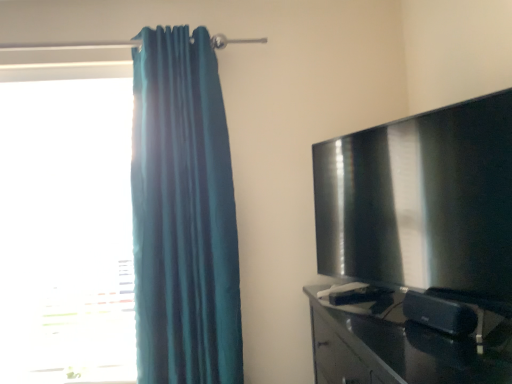
Question: Is matte black tv at right to the right of transparent glass window at left from the viewer's perspective?

Choices:
 (A) no
 (B) yes

Answer: (B)

Question: Is matte black tv at right next to transparent glass window at left and touching it?

Choices:
 (A) yes
 (B) no

Answer: (B)

Question: Is matte black tv at right positioned beyond the bounds of transparent glass window at left?

Choices:
 (A) no
 (B) yes

Answer: (B)

Question: Is matte black tv at right thinner than transparent glass window at left?

Choices:
 (A) no
 (B) yes

Answer: (A)

Question: Does matte black tv at right appear on the left side of transparent glass window at left?

Choices:
 (A) yes
 (B) no

Answer: (B)

Question: From the image's perspective, is glossy black tv stand at right above or below transparent glass window at left?

Choices:
 (A) below
 (B) above

Answer: (A)

Question: Is glossy black tv stand at right spatially inside transparent glass window at left, or outside of it?

Choices:
 (A) outside
 (B) inside

Answer: (A)

Question: In terms of size, does glossy black tv stand at right appear bigger or smaller than transparent glass window at left?

Choices:
 (A) big
 (B) small

Answer: (A)

Question: From a real-world perspective, is glossy black tv stand at right above or below transparent glass window at left?

Choices:
 (A) above
 (B) below

Answer: (B)

Question: In the image, is teal fabric curtain at left positioned in front of or behind matte black tv at right?

Choices:
 (A) front
 (B) behind

Answer: (B)

Question: Is teal fabric curtain at left to the left or to the right of matte black tv at right in the image?

Choices:
 (A) left
 (B) right

Answer: (A)

Question: Looking at their shapes, would you say teal fabric curtain at left is wider or thinner than matte black tv at right?

Choices:
 (A) thin
 (B) wide

Answer: (B)

Question: From the image's perspective, relative to matte black tv at right, is teal fabric curtain at left above or below?

Choices:
 (A) below
 (B) above

Answer: (B)

Question: From the image's perspective, is glossy black tv stand at right positioned above or below matte black tv at right?

Choices:
 (A) below
 (B) above

Answer: (A)

Question: In terms of height, does glossy black tv stand at right look taller or shorter compared to matte black tv at right?

Choices:
 (A) tall
 (B) short

Answer: (B)